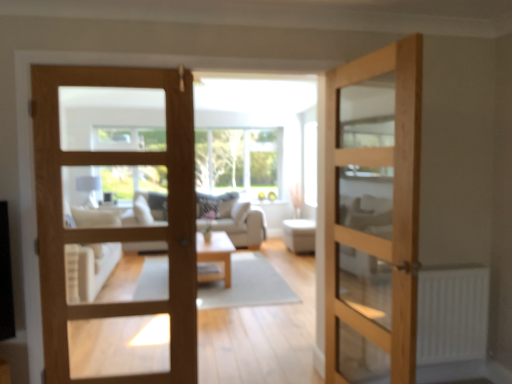
Image resolution: width=512 pixels, height=384 pixels. I want to click on light wood/texture coffee table at center, so click(x=214, y=257).

Describe the element at coordinates (298, 234) in the screenshot. The width and height of the screenshot is (512, 384). I see `white fabric ottoman at center` at that location.

This screenshot has width=512, height=384. In order to click on natural wood door at center, the first door in the right-to-left sequence in this screenshot , I will do [373, 214].

From the image's perspective, who appears lower, natural wood door at center, the first door in the right-to-left sequence, or clear glass window at center?

natural wood door at center, the first door in the right-to-left sequence, is shown below in the image.

Considering their positions, is natural wood door at center, which is the second door from left to right, located in front of or behind clear glass window at center?

Clearly, natural wood door at center, which is the second door from left to right, is in front of clear glass window at center.

Between natural wood door at center, the first door in the right-to-left sequence, and clear glass window at center, which one appears on the left side from the viewer's perspective?

From the viewer's perspective, clear glass window at center appears more on the left side.

From a real-world perspective, is natural wood door at center, the first door in the right-to-left sequence, positioned over clear glass window at center based on gravity?

No.

Which object is wider, clear glass window at center or natural wood door at center, which is the second door from left to right?

With larger width is clear glass window at center.

Is the depth of clear glass window at center less than that of natural wood door at center, the first door in the right-to-left sequence?

No.

Considering the sizes of objects clear glass window at center and natural wood door at center, which is the second door from left to right, in the image provided, who is shorter, clear glass window at center or natural wood door at center, which is the second door from left to right,?

Standing shorter between the two is clear glass window at center.

Between white matte radiator at lower right and natural wood door at center, the first door in the right-to-left sequence, which one has less height?

white matte radiator at lower right is shorter.

From a real-world perspective, relative to natural wood door at center, which is the second door from left to right, is white matte radiator at lower right vertically above or below?

Clearly, from a real-world perspective, white matte radiator at lower right is below natural wood door at center, which is the second door from left to right.

Could you tell me if white matte radiator at lower right is facing natural wood door at center, which is the second door from left to right?

No, white matte radiator at lower right is not facing towards natural wood door at center, which is the second door from left to right.

Considering the points (421, 324) and (368, 205), which point is in front, point (421, 324) or point (368, 205)?

Point (421, 324)

Can you confirm if white matte radiator at lower right is positioned to the right of light wood/texture coffee table at center?

Indeed, white matte radiator at lower right is positioned on the right side of light wood/texture coffee table at center.

Can you confirm if white matte radiator at lower right is taller than light wood/texture coffee table at center?

Yes, white matte radiator at lower right is taller than light wood/texture coffee table at center.

Considering the sizes of objects white matte radiator at lower right and light wood/texture coffee table at center in the image provided, who is smaller, white matte radiator at lower right or light wood/texture coffee table at center?

white matte radiator at lower right is smaller.

Is white matte radiator at lower right further to the viewer compared to light wood/texture coffee table at center?

That is False.

Is the surface of white fabric ottoman at center in direct contact with light wood/texture coffee table at center?

They are not placed beside each other.

Considering the relative sizes of white fabric ottoman at center and light wood/texture coffee table at center in the image provided, is white fabric ottoman at center bigger than light wood/texture coffee table at center?

No.

Which object is thinner, white fabric ottoman at center or light wood/texture coffee table at center?

white fabric ottoman at center.

Does white fabric ottoman at center have a greater height compared to light wood/texture coffee table at center?

Indeed, white fabric ottoman at center has a greater height compared to light wood/texture coffee table at center.

From a real-world perspective, who is located higher, natural wood door at center, the first door in the right-to-left sequence, or white matte radiator at lower right?

In real-world perspective, natural wood door at center, the first door in the right-to-left sequence, is above.

Is natural wood door at center, which is the second door from left to right, not close to white matte radiator at lower right?

No, natural wood door at center, which is the second door from left to right, is not far away from white matte radiator at lower right.

Between natural wood door at center, the first door in the right-to-left sequence, and white matte radiator at lower right, which one has smaller size?

white matte radiator at lower right.

What's the angular difference between white matte radiator at lower right and white fabric ottoman at center's facing directions?

3.3 degrees separate the facing orientations of white matte radiator at lower right and white fabric ottoman at center.

Who is shorter, white matte radiator at lower right or white fabric ottoman at center?

white fabric ottoman at center is shorter.

Is white matte radiator at lower right far from white fabric ottoman at center?

Indeed, white matte radiator at lower right is not near white fabric ottoman at center.

Which door is the 2nd one when counting from the front of the clear glass window at center? Please provide its 2D coordinates.

[(373, 214)]

Locate an element on the screen. The image size is (512, 384). window above the natural wood door at center, which is the second door from left to right (from a real-world perspective) is located at coordinates (240, 161).

Estimate the real-world distances between objects in this image. Which object is further from white fabric ottoman at center, clear glass window at center or light wood/texture coffee table at center?

Based on the image, clear glass window at center appears to be further to white fabric ottoman at center.

Estimate the real-world distances between objects in this image. Which object is further from clear glass window at center, white matte radiator at lower right or natural wood door at center, which is the second door from left to right?

white matte radiator at lower right.

Which object lies further to the anchor point light brown wooden door at center, which appears as the 2th door when viewed from the right, white fabric ottoman at center or clear glass window at center?

Based on the image, clear glass window at center appears to be further to light brown wooden door at center, which appears as the 2th door when viewed from the right.

Which object lies nearer to the anchor point white matte radiator at lower right, white fabric ottoman at center or light wood/texture coffee table at center?

light wood/texture coffee table at center is closer to white matte radiator at lower right.

Based on their spatial positions, is light brown wooden door at center, which appears as the 2th door when viewed from the right, or natural wood door at center, which is the second door from left to right, closer to white matte radiator at lower right?

Based on the image, natural wood door at center, which is the second door from left to right, appears to be nearer to white matte radiator at lower right.

Based on their spatial positions, is natural wood door at center, the first door in the right-to-left sequence, or white matte radiator at lower right closer to light brown wooden door at center, which appears as the 2th door when viewed from the right?

natural wood door at center, the first door in the right-to-left sequence, lies closer to light brown wooden door at center, which appears as the 2th door when viewed from the right, than the other object.

When comparing their distances from white fabric ottoman at center, does light brown wooden door at center, which appears as the 2th door when viewed from the right, or clear glass window at center seem closer?

Based on the image, clear glass window at center appears to be nearer to white fabric ottoman at center.

Considering their positions, is white matte radiator at lower right positioned further to light brown wooden door at center, the 1th door in the left-to-right sequence, than white fabric ottoman at center?

Among the two, white fabric ottoman at center is located further to light brown wooden door at center, the 1th door in the left-to-right sequence.

I want to click on radiator between light brown wooden door at center, the 1th door in the left-to-right sequence, and clear glass window at center in the front-back direction, so click(452, 315).

At what (x,y) coordinates should I click in order to perform the action: click on table positioned between white matte radiator at lower right and clear glass window at center from near to far. Please return your answer as a coordinate pair (x, y). This screenshot has width=512, height=384. Looking at the image, I should click on (214, 257).

At what (x,y) coordinates should I click in order to perform the action: click on door positioned between natural wood door at center, the first door in the right-to-left sequence, and white fabric ottoman at center from near to far. Please return your answer as a coordinate pair (x, y). Looking at the image, I should click on (121, 227).

The width and height of the screenshot is (512, 384). In order to click on furniture between natural wood door at center, the first door in the right-to-left sequence, and clear glass window at center, along the z-axis in this screenshot , I will do `click(298, 234)`.